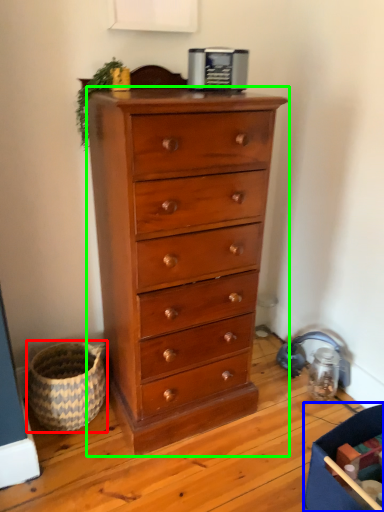
Question: Estimate the real-world distances between objects in this image. Which object is closer to basket (highlighted by a red box), storage box (highlighted by a blue box) or chest of drawers (highlighted by a green box)?

Choices:
 (A) storage box
 (B) chest of drawers

Answer: (B)